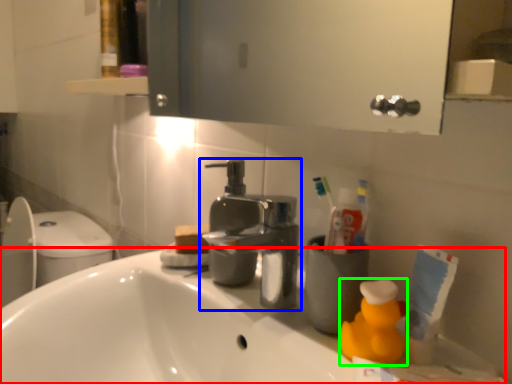
Question: Which object is positioned closest to counter top (highlighted by a red box)? Select from tap (highlighted by a blue box) and cleaning product (highlighted by a green box).

Choices:
 (A) tap
 (B) cleaning product

Answer: (A)